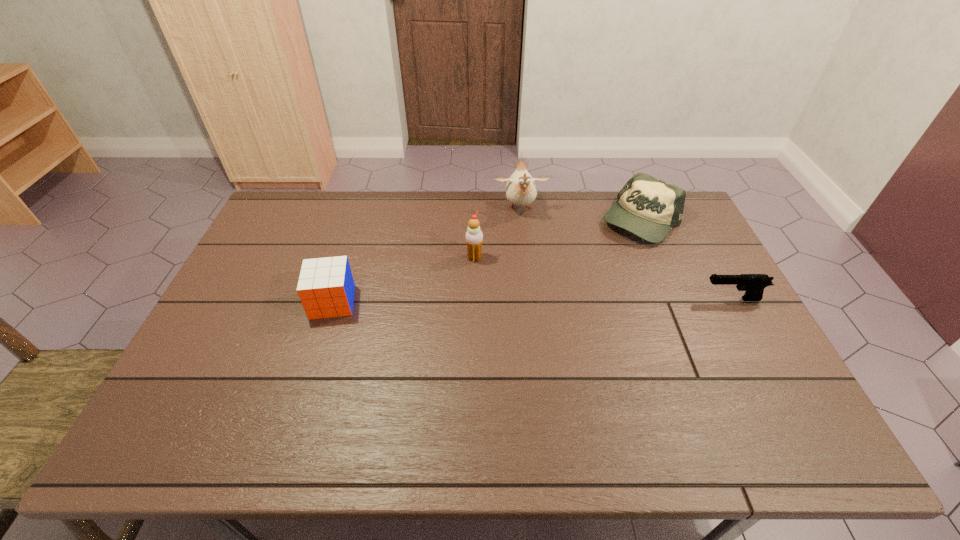
You are a GUI agent. You are given a task and a screenshot of the screen. Output one action in this format:
    pyautogui.click(x=<x>, y=<y>)
    Task: Click on the vacant area that lies between the icecream and the baseball cap
    
    Given the screenshot: What is the action you would take?
    pyautogui.click(x=558, y=239)

At what (x,y) coordinates should I click in order to perform the action: click on vacant area that lies between the pistol and the cube. Please return your answer as a coordinate pair (x, y). Looking at the image, I should click on (532, 301).

Where is `free space that is in between the baseball cap and the bird`? free space that is in between the baseball cap and the bird is located at coordinates (581, 215).

The image size is (960, 540). What are the coordinates of `free space that is in between the baseball cap and the pistol` in the screenshot? It's located at (686, 260).

The image size is (960, 540). I want to click on free space between the cube and the pistol, so click(532, 301).

This screenshot has height=540, width=960. I want to click on free spot between the cube and the third object from right to left, so click(x=426, y=255).

This screenshot has height=540, width=960. Find the location of `empty space between the cube and the baseball cap`. empty space between the cube and the baseball cap is located at coordinates (487, 261).

Where is `empty space between the baseball cap and the third object from right to left`? This screenshot has height=540, width=960. empty space between the baseball cap and the third object from right to left is located at coordinates (581, 215).

The height and width of the screenshot is (540, 960). I want to click on free space between the third nearest object and the leftmost object, so click(x=403, y=280).

Locate which object is the closest to the pistol. Please provide its 2D coordinates. Your answer should be formatted as a tuple, i.e. [(x, y)], where the tuple contains the x and y coordinates of a point satisfying the conditions above.

[(647, 207)]